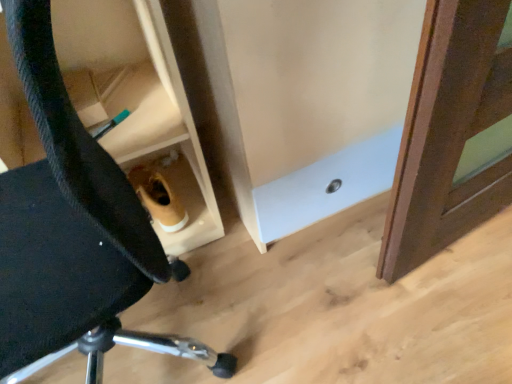
You are a GUI agent. You are given a task and a screenshot of the screen. Output one action in this format:
    pyautogui.click(x=<x>, y=<y>)
    Task: Click on the wooden cabinet at lower center
    The height and width of the screenshot is (384, 512).
    Given the screenshot: What is the action you would take?
    pyautogui.click(x=183, y=191)

What do you see at coordinates (183, 191) in the screenshot? This screenshot has width=512, height=384. I see `wooden cabinet at lower center` at bounding box center [183, 191].

What do you see at coordinates (74, 231) in the screenshot?
I see `black fabric chair at lower left` at bounding box center [74, 231].

Where is `black fabric chair at lower left`? Image resolution: width=512 pixels, height=384 pixels. black fabric chair at lower left is located at coordinates (74, 231).

I want to click on wooden cabinet at lower center, so click(x=183, y=191).

Which is more to the left, wooden cabinet at lower center or black fabric chair at lower left?

black fabric chair at lower left is more to the left.

Is wooden cabinet at lower center positioned before black fabric chair at lower left?

No.

Does point (201, 169) appear closer or farther from the camera than point (56, 238)?

Clearly, point (201, 169) is more distant from the camera than point (56, 238).

From the picture: From the image's perspective, between wooden cabinet at lower center and black fabric chair at lower left, who is located below?

From the image's view, black fabric chair at lower left is below.

From a real-world perspective, is wooden cabinet at lower center located higher than black fabric chair at lower left?

Actually, wooden cabinet at lower center is physically below black fabric chair at lower left in the real world.

Which object is wider, wooden cabinet at lower center or black fabric chair at lower left?

black fabric chair at lower left is wider.

Is wooden cabinet at lower center taller than black fabric chair at lower left?

In fact, wooden cabinet at lower center may be shorter than black fabric chair at lower left.

Which of these two, wooden cabinet at lower center or black fabric chair at lower left, is bigger?

With larger size is black fabric chair at lower left.

Is black fabric chair at lower left surrounded by wooden cabinet at lower center?

No, black fabric chair at lower left is located outside of wooden cabinet at lower center.

Consider the image. Are wooden cabinet at lower center and black fabric chair at lower left making contact?

No.

Is black fabric chair at lower left at the back of wooden cabinet at lower center?

That's not correct — wooden cabinet at lower center is not looking away from black fabric chair at lower left.

How distant is wooden cabinet at lower center from black fabric chair at lower left?

36.42 centimeters.

Find the location of a particular element. cabinetry that is above the black fabric chair at lower left (from the image's perspective) is located at coordinates (183, 191).

Does black fabric chair at lower left appear on the right side of wooden cabinet at lower center?

Incorrect, black fabric chair at lower left is not on the right side of wooden cabinet at lower center.

Is black fabric chair at lower left positioned behind wooden cabinet at lower center?

No, black fabric chair at lower left is in front of wooden cabinet at lower center.

Does point (26, 183) come in front of point (172, 186)?

Yes, it is in front of point (172, 186).

From the image's perspective, is black fabric chair at lower left positioned above or below wooden cabinet at lower center?

Clearly, from the image's perspective, black fabric chair at lower left is below wooden cabinet at lower center.

From a real-world perspective, is black fabric chair at lower left under wooden cabinet at lower center?

No, from a real-world perspective, black fabric chair at lower left is not beneath wooden cabinet at lower center.

Is black fabric chair at lower left wider or thinner than wooden cabinet at lower center?

In the image, black fabric chair at lower left appears to be wider than wooden cabinet at lower center.

Does black fabric chair at lower left have a lesser height compared to wooden cabinet at lower center?

In fact, black fabric chair at lower left may be taller than wooden cabinet at lower center.

From the picture: Can you confirm if black fabric chair at lower left is smaller than wooden cabinet at lower center?

No.

Is black fabric chair at lower left not inside wooden cabinet at lower center?

Yes, black fabric chair at lower left is not within wooden cabinet at lower center.

Consider the image. Is black fabric chair at lower left not near wooden cabinet at lower center?

No.

Is black fabric chair at lower left oriented towards wooden cabinet at lower center?

No, black fabric chair at lower left is not turned towards wooden cabinet at lower center.

What's the angular difference between black fabric chair at lower left and wooden cabinet at lower center's facing directions?

100 degrees separate the facing orientations of black fabric chair at lower left and wooden cabinet at lower center.

Measure the distance from black fabric chair at lower left to wooden cabinet at lower center.

They are 36.42 centimeters apart.

What are the coordinates of `cabinetry on the right side of black fabric chair at lower left` in the screenshot? It's located at (183, 191).

I want to click on cabinetry behind the black fabric chair at lower left, so click(183, 191).

You are a GUI agent. You are given a task and a screenshot of the screen. Output one action in this format:
    pyautogui.click(x=<x>, y=<y>)
    Task: Click on the cabinetry that is on the right side of black fabric chair at lower left
    
    Given the screenshot: What is the action you would take?
    pyautogui.click(x=183, y=191)